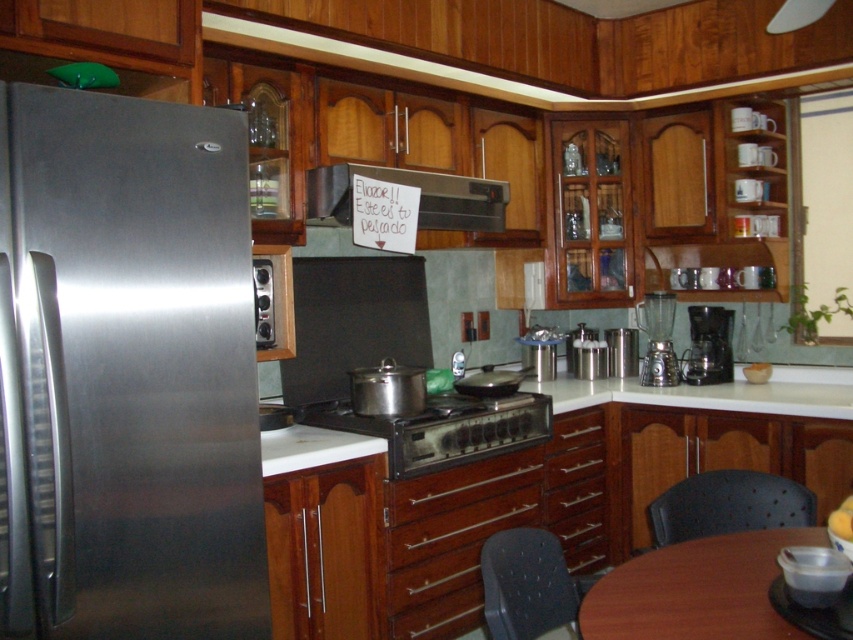
You are standing in the kitchen and want to reach both the refrigerator on the left and the microwave oven next to it. You notice two points marked on the floor at coordinates point (561,529) and point (267,324). Which point is closer to the refrigerator on the left?

Point (267,324) is closer to the refrigerator on the left because it is in front of point (561,529), which is further back.

You are organizing the kitchen and need to place a large baking tray. Which object between the wooden drawer at lower center and the satin black stove at center can accommodate the tray based on their sizes?

The wooden drawer at lower center is larger in size than the satin black stove at center, so the wooden drawer at lower center can accommodate the large baking tray.

You are a delivery person who just arrived with a new microwave that measures 1.8 meters in length. You need to place it between the stainless steel refrigerator at left and the white glossy countertop at center. Can the microwave fit in that space?

The stainless steel refrigerator at left and white glossy countertop at center are 1.94 meters apart from each other. Since the microwave is 1.8 meters long, it can fit in the space between them with 0.14 meters of clearance remaining.